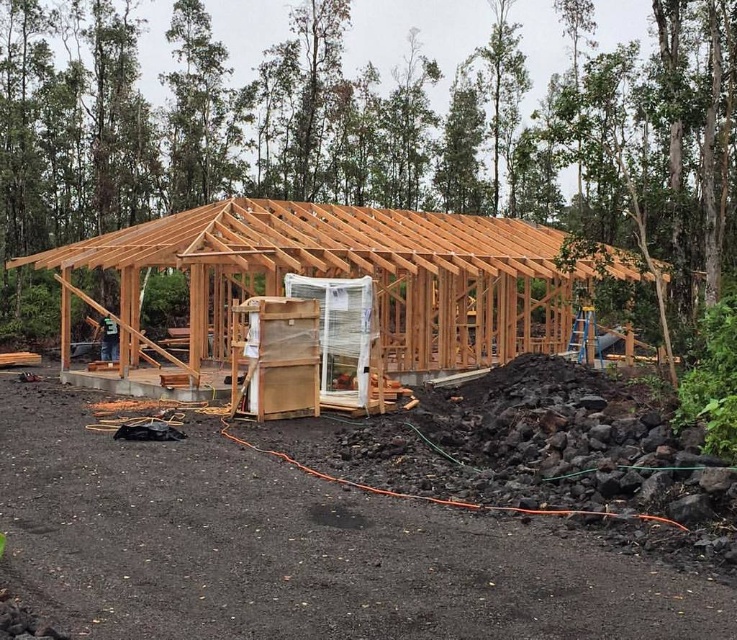
You are an architect inspecting a construction site. You notice the natural wood frame at center and the natural wood roof at center. Which one has a larger size according to the description?

The natural wood roof at center has a larger size compared to the natural wood frame at center.

You are standing at the construction site and want to place a heavy tool on the ground. You have two options for placement points marked as point 1 at coordinates point (x=136, y=346) and point 2 at coordinates point (x=499, y=221). Which point is closer to you where you can place the tool without needing to move further?

Point (x=136, y=346) is closer to the camera than point (x=499, y=221), so you should place the tool at point (x=136, y=346) to avoid moving further.

Based on the photo, you are standing at the origin point of the coordinate system with the construction site as your reference. Where is the natural wood frame at center located in terms of coordinates?

The natural wood frame at center is located at coordinates point [357,275].